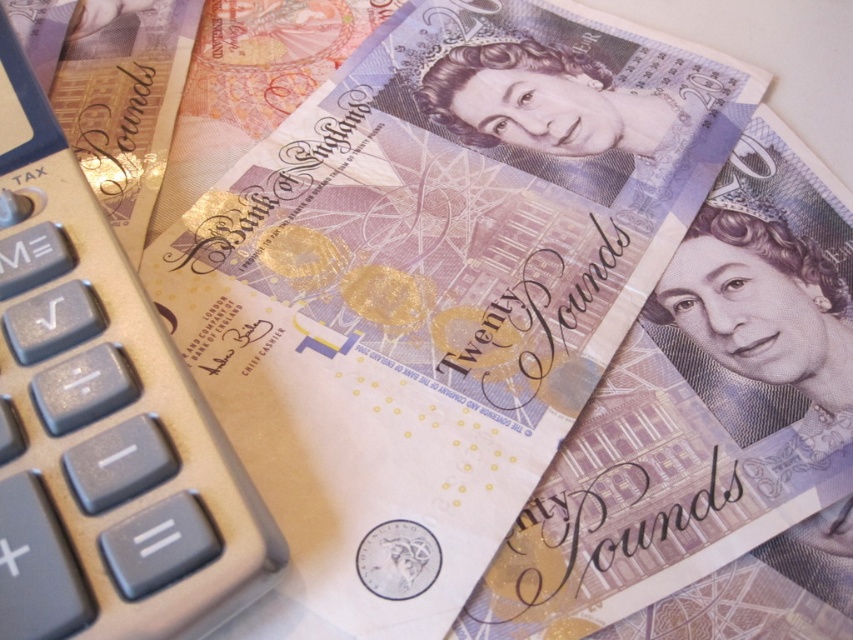
You are organizing a display and need to place the matte purple banknote at center and the silver metallic calculator at left. According to the image, which object should be placed to the leftmost position?

The silver metallic calculator at left should be placed to the leftmost position because the matte purple banknote at center is positioned on the right side of it.

You are organizing a cash register and notice the matte purple banknote at center and the silver metallic calculator at left. Which object is closer to you?

The matte purple banknote at center is closer to you because the silver metallic calculator at left is behind it.